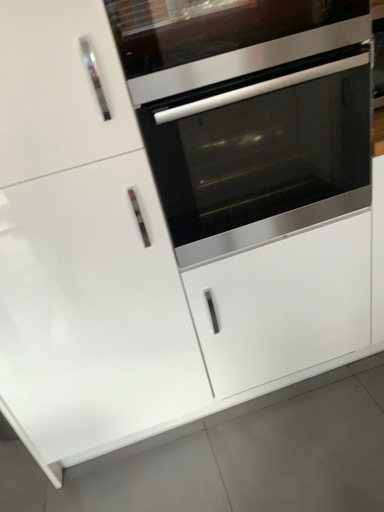
Question: Do you think white glossy drawer at center is within stainless steel oven at center, or outside of it?

Choices:
 (A) outside
 (B) inside

Answer: (A)

Question: Is point (236, 362) closer or farther from the camera than point (201, 24)?

Choices:
 (A) closer
 (B) farther

Answer: (B)

Question: Which object is positioned closest to the stainless steel oven at center?

Choices:
 (A) stainless steel oven at center
 (B) white glossy drawer at center
 (C) white glossy door at center

Answer: (A)

Question: Estimate the real-world distances between objects in this image. Which object is closer to the white glossy door at center?

Choices:
 (A) white glossy drawer at center
 (B) stainless steel oven at center
 (C) stainless steel oven at center

Answer: (A)